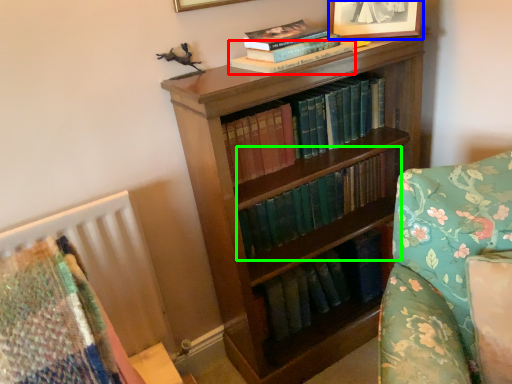
Question: Estimate the real-world distances between objects in this image. Which object is closer to book (highlighted by a red box), picture frame (highlighted by a blue box) or book (highlighted by a green box)?

Choices:
 (A) picture frame
 (B) book

Answer: (A)